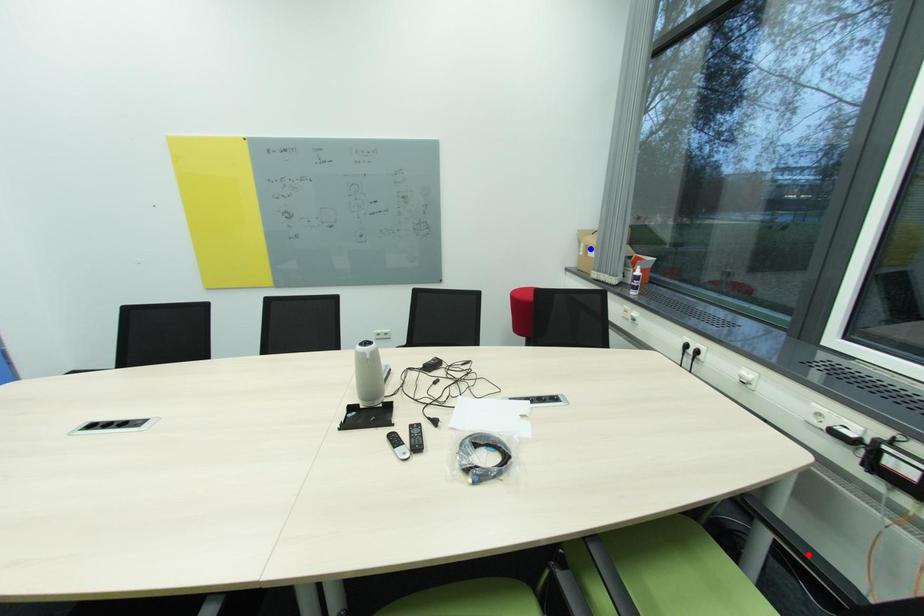
Question: Which of the two points in the image is closer to the camera?

Choices:
 (A) Blue point is closer.
 (B) Red point is closer.

Answer: (B)